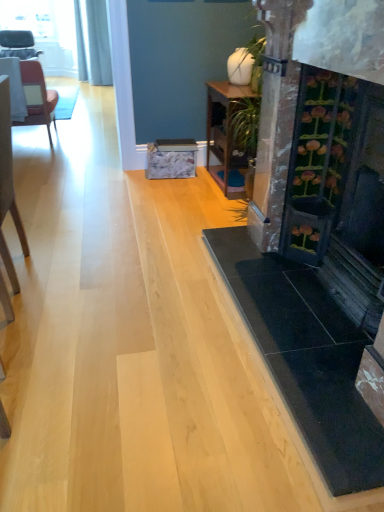
Question: From a real-world perspective, is white fabric table at left, arranged as the 2th table when ordered from the bottom, below matte brown chair at left, placed as the second chair when sorted from left to right?

Choices:
 (A) no
 (B) yes

Answer: (A)

Question: Can you confirm if white fabric table at left, the 1th table when ordered from left to right, is positioned to the right of matte brown chair at left, placed as the second chair when sorted from left to right?

Choices:
 (A) yes
 (B) no

Answer: (A)

Question: Is white fabric table at left, the second table in the front-to-back sequence, in contact with matte brown chair at left, positioned as the 2th chair in bottom-to-top order?

Choices:
 (A) yes
 (B) no

Answer: (B)

Question: Does white fabric table at left, the 1th table when ordered from left to right, have a greater height compared to matte brown chair at left, which is counted as the second chair, starting from the right?

Choices:
 (A) yes
 (B) no

Answer: (B)

Question: From the image's perspective, is white fabric table at left, the second table in the front-to-back sequence, on matte brown chair at left, the 2th chair from the front?

Choices:
 (A) no
 (B) yes

Answer: (A)

Question: Does point (11, 112) appear closer or farther from the camera than point (41, 51)?

Choices:
 (A) closer
 (B) farther

Answer: (A)

Question: Based on their sizes in the image, would you say white fabric table at left, the second table in the front-to-back sequence, is bigger or smaller than matte black chair at upper left, the 3th chair from the front?

Choices:
 (A) small
 (B) big

Answer: (A)

Question: From a real-world perspective, relative to matte black chair at upper left, the 1th chair in the back-to-front sequence, is white fabric table at left, the 2th table positioned from the right, vertically above or below?

Choices:
 (A) below
 (B) above

Answer: (B)

Question: From the image's perspective, is white fabric table at left, the 1th table when ordered from left to right, above or below matte black chair at upper left, the 1th chair in the back-to-front sequence?

Choices:
 (A) above
 (B) below

Answer: (B)

Question: Is wooden table at center, which is the second table in left-to-right order, in front of or behind light brown wooden chair at left, the first chair in the bottom-to-top sequence, in the image?

Choices:
 (A) front
 (B) behind

Answer: (B)

Question: Considering the positions of wooden table at center, acting as the 1th table starting from the bottom, and light brown wooden chair at left, the first chair in the bottom-to-top sequence, in the image, is wooden table at center, acting as the 1th table starting from the bottom, taller or shorter than light brown wooden chair at left, the first chair in the bottom-to-top sequence,?

Choices:
 (A) short
 (B) tall

Answer: (A)

Question: From the image's perspective, is wooden table at center, which is the first table in right-to-left order, positioned above or below light brown wooden chair at left, which appears as the 1th chair when viewed from the front?

Choices:
 (A) above
 (B) below

Answer: (A)

Question: Does point (221, 138) appear closer or farther from the camera than point (4, 90)?

Choices:
 (A) farther
 (B) closer

Answer: (A)

Question: Is matte black chair at upper left, the 1th chair in the back-to-front sequence, situated inside matte brown chair at left, placed as the second chair when sorted from left to right, or outside?

Choices:
 (A) outside
 (B) inside

Answer: (A)

Question: Would you say matte black chair at upper left, the third chair from the bottom, is to the left or to the right of matte brown chair at left, the 2th chair from the front, in the picture?

Choices:
 (A) left
 (B) right

Answer: (A)